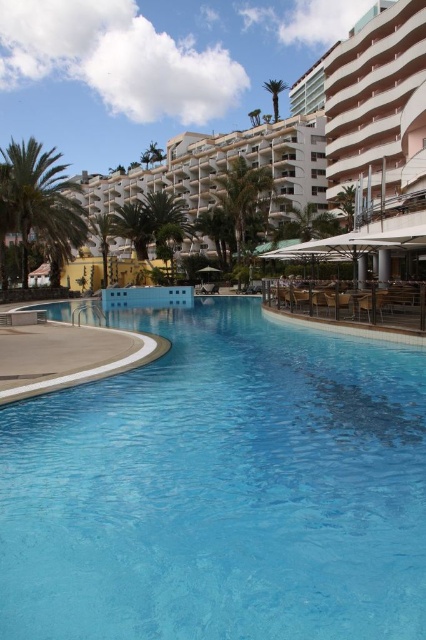
Does transparent glass pool at center have a greater height compared to white glossy building at upper center?

No.

Does point (296, 508) come behind point (138, 176)?

That is False.

Describe the element at coordinates (219, 488) in the screenshot. I see `transparent glass pool at center` at that location.

Image resolution: width=426 pixels, height=640 pixels. In order to click on transparent glass pool at center in this screenshot , I will do `click(219, 488)`.

Between transparent glass pool at center and green leafy palm tree at center, which one is positioned higher?

green leafy palm tree at center is higher up.

Which is more to the left, transparent glass pool at center or green leafy palm tree at center?

green leafy palm tree at center is more to the left.

Find the location of a particular element. The image size is (426, 640). transparent glass pool at center is located at coordinates (219, 488).

This screenshot has width=426, height=640. In order to click on transparent glass pool at center in this screenshot , I will do `click(219, 488)`.

Which is in front, point (351, 204) or point (273, 83)?

Positioned in front is point (351, 204).

Can you confirm if green leafy palm tree at upper right is positioned below green leafy palm tree at upper center?

Yes, green leafy palm tree at upper right is below green leafy palm tree at upper center.

You are a GUI agent. You are given a task and a screenshot of the screen. Output one action in this format:
    pyautogui.click(x=<x>, y=<y>)
    Task: Click on the green leafy palm tree at upper right
    Image resolution: width=426 pixels, height=640 pixels.
    Given the screenshot: What is the action you would take?
    pyautogui.click(x=347, y=205)

Image resolution: width=426 pixels, height=640 pixels. Identify the location of green leafy palm tree at upper right. (347, 205).